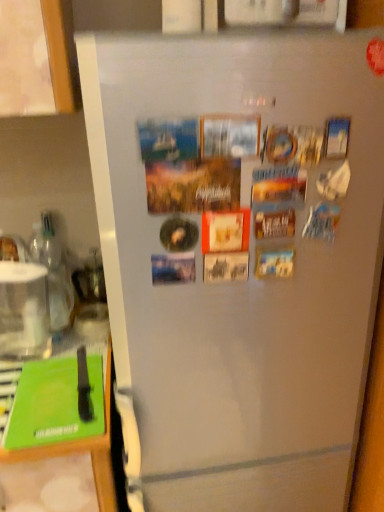
Find the location of a particular element. This screenshot has width=384, height=512. green plastic cutting board at lower left is located at coordinates (83, 450).

From the image's perspective, which one is positioned higher, clear glass water at left or green plastic cutting board at lower left?

clear glass water at left appears higher in the image.

Are clear glass water at left and green plastic cutting board at lower left located far from each other?

That's not correct — clear glass water at left is a little close to green plastic cutting board at lower left.

This screenshot has height=512, width=384. I want to click on appliance behind the green plastic cutting board at lower left, so (x=23, y=308).

Which of these two, green plastic cutting board at lower left or clear glass water at left, is thinner?

Thinner between the two is clear glass water at left.

From the image's perspective, is green plastic cutting board at lower left below clear glass water at left?

Correct, green plastic cutting board at lower left appears lower than clear glass water at left in the image.

Consider the image. What's the angular difference between green plastic cutting board at lower left and clear glass water at left's facing directions?

The facing directions of green plastic cutting board at lower left and clear glass water at left are 0.000931 degrees apart.

Choose the correct answer: Is green plastic cutting board at lower left inside clear glass water at left or outside it?

green plastic cutting board at lower left lies outside clear glass water at left.

Is green matte magazine at lower left looking in the opposite direction of green plastic cutting board at lower left?

That's right, green matte magazine at lower left is facing away from green plastic cutting board at lower left.

How far apart are green matte magazine at lower left and green plastic cutting board at lower left?

green matte magazine at lower left is 8.63 centimeters from green plastic cutting board at lower left.

Does green matte magazine at lower left contain green plastic cutting board at lower left?

No, green plastic cutting board at lower left is not a part of green matte magazine at lower left.

In order to click on magazine positioned vertically above the green plastic cutting board at lower left (from a real-world perspective) in this screenshot , I will do `click(48, 402)`.

Is clear glass water at left at the back of green matte magazine at lower left?

green matte magazine at lower left does not have its back to clear glass water at left.

From a real-world perspective, is green matte magazine at lower left below clear glass water at left?

Yes, from a real-world perspective, green matte magazine at lower left is beneath clear glass water at left.

Considering the relative sizes of green matte magazine at lower left and clear glass water at left in the image provided, is green matte magazine at lower left smaller than clear glass water at left?

Correct, green matte magazine at lower left occupies less space than clear glass water at left.

Is green matte magazine at lower left shorter than clear glass water at left?

Yes.

Would you say green matte magazine at lower left is part of green plastic cutting board at lower left's contents?

Absolutely, green matte magazine at lower left is inside green plastic cutting board at lower left.

Considering the relative sizes of green plastic cutting board at lower left and green matte magazine at lower left in the image provided, is green plastic cutting board at lower left shorter than green matte magazine at lower left?

No, green plastic cutting board at lower left is not shorter than green matte magazine at lower left.

From the image's perspective, is green plastic cutting board at lower left under green matte magazine at lower left?

Correct, green plastic cutting board at lower left appears lower than green matte magazine at lower left in the image.

From a real-world perspective, between green plastic cutting board at lower left and green matte magazine at lower left, who is vertically lower?

From a 3D spatial view, green plastic cutting board at lower left is below.

Which object is thinner, clear glass water at left or green matte magazine at lower left?

Thinner between the two is clear glass water at left.

How different are the orientations of clear glass water at left and green matte magazine at lower left in degrees?

2.15 degrees.

Considering the positions of objects clear glass water at left and green matte magazine at lower left in the image provided, who is more to the right, clear glass water at left or green matte magazine at lower left?

green matte magazine at lower left is more to the right.

From the image's perspective, is clear glass water at left above or below green matte magazine at lower left?

Based on their image positions, clear glass water at left is located above green matte magazine at lower left.

Where is `counter top below the clear glass water at left (from a real-world perspective)`? The image size is (384, 512). counter top below the clear glass water at left (from a real-world perspective) is located at coordinates (83, 450).

What are the coordinates of `counter top on the left of clear glass water at left` in the screenshot? It's located at (83, 450).

In the scene shown: From the image, which object appears to be nearer to clear glass water at left, green matte magazine at lower left or green plastic cutting board at lower left?

The object closer to clear glass water at left is green matte magazine at lower left.

Which object lies further to the anchor point green matte magazine at lower left, green plastic cutting board at lower left or clear glass water at left?

clear glass water at left is positioned further to the anchor green matte magazine at lower left.

Estimate the real-world distances between objects in this image. Which object is further from green plastic cutting board at lower left, green matte magazine at lower left or clear glass water at left?

clear glass water at left.

From the image, which object appears to be nearer to green matte magazine at lower left, clear glass water at left or green plastic cutting board at lower left?

green plastic cutting board at lower left lies closer to green matte magazine at lower left than the other object.

When comparing their distances from clear glass water at left, does green plastic cutting board at lower left or green matte magazine at lower left seem closer?

green matte magazine at lower left lies closer to clear glass water at left than the other object.

Based on their spatial positions, is clear glass water at left or green matte magazine at lower left further from green plastic cutting board at lower left?

The object further to green plastic cutting board at lower left is clear glass water at left.

This screenshot has width=384, height=512. I want to click on magazine between clear glass water at left and green plastic cutting board at lower left in the vertical direction, so click(x=48, y=402).